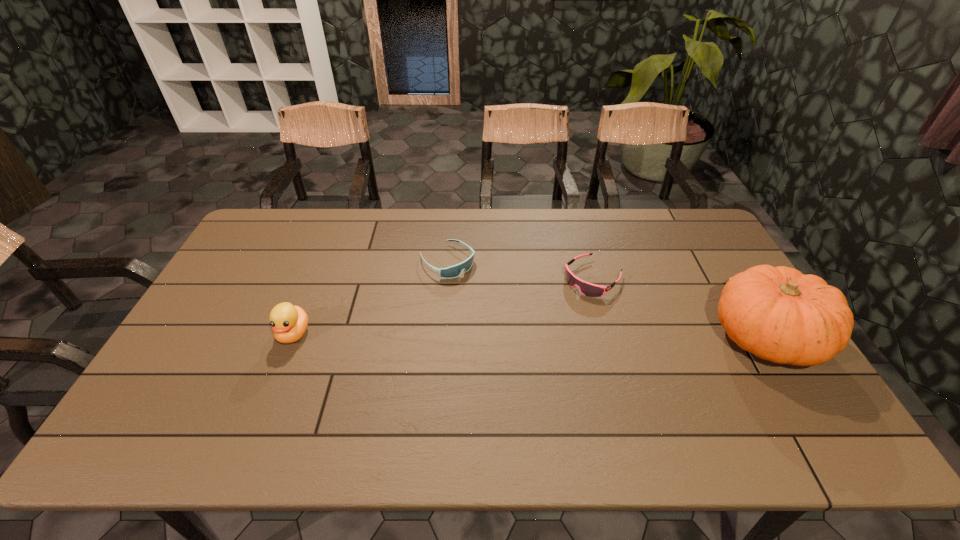
The width and height of the screenshot is (960, 540). I want to click on vacant space at the left edge, so click(206, 321).

I want to click on vacant region at the right edge of the desktop, so click(725, 331).

Identify the location of free space at the far left corner of the desktop. (268, 213).

Where is `vacant area at the far right corner`? This screenshot has height=540, width=960. vacant area at the far right corner is located at coordinates pyautogui.click(x=696, y=219).

Locate an element on the screen. The image size is (960, 540). vacant space in between the third shortest object and the left goggles is located at coordinates (371, 298).

Locate an element on the screen. vacant point located between the second tallest object and the second object from right to left is located at coordinates (444, 306).

The height and width of the screenshot is (540, 960). Identify the location of blank region between the rightmost object and the third object from left to right. (679, 307).

The image size is (960, 540). I want to click on vacant region between the tallest object and the second tallest object, so click(x=530, y=335).

This screenshot has width=960, height=540. Identify the location of vacant space that is in between the tallest object and the right goggles. (679, 307).

At what (x,y) coordinates should I click in order to perform the action: click on empty location between the rightmost object and the left goggles. Please return your answer as a coordinate pair (x, y). Looking at the image, I should click on (607, 299).